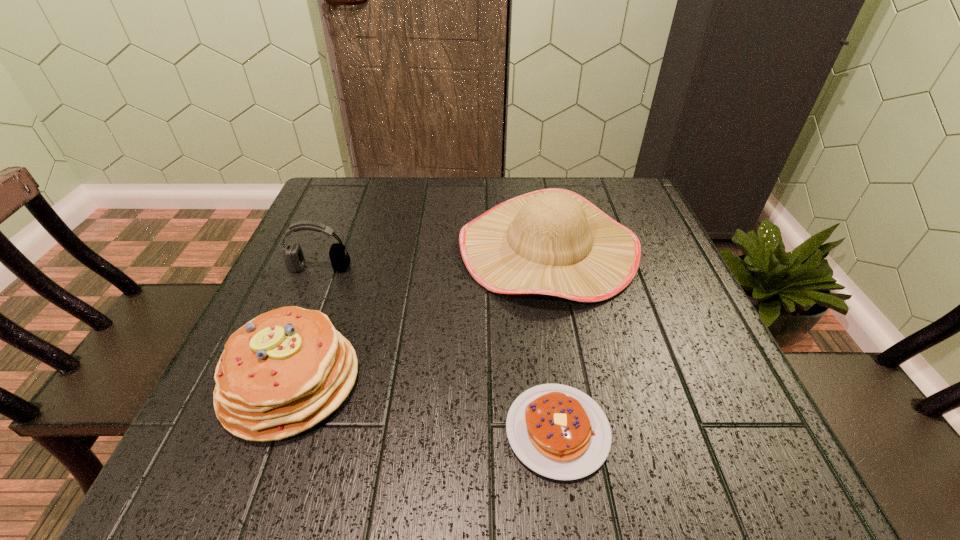
At what (x,y) coordinates should I click in order to perform the action: click on headset at the left edge. Please return your answer as a coordinate pair (x, y). Looking at the image, I should click on (294, 258).

Identify the location of pancake that is at the left edge. This screenshot has width=960, height=540. (283, 372).

Find the location of a particular element. The image size is (960, 540). object at the right edge is located at coordinates (553, 241).

This screenshot has width=960, height=540. I want to click on object that is at the near left corner, so click(x=283, y=372).

Locate an element on the screen. The width and height of the screenshot is (960, 540). object that is at the far right corner is located at coordinates (553, 241).

Find the location of a particular element. vacant region at the far edge of the desktop is located at coordinates (427, 194).

The width and height of the screenshot is (960, 540). I want to click on free point at the near edge, so click(485, 476).

Where is `vacant point at the right edge`? vacant point at the right edge is located at coordinates (735, 397).

I want to click on free location at the near left corner, so click(195, 437).

Where is `blank space at the far right corner`? The image size is (960, 540). blank space at the far right corner is located at coordinates (615, 219).